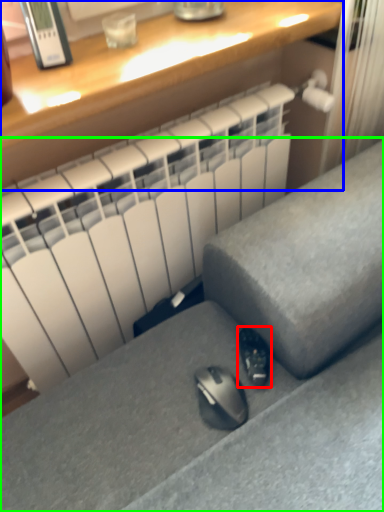
Question: Which is farther away from shoe (highlighted by a red box)? desk (highlighted by a blue box) or furniture (highlighted by a green box)?

Choices:
 (A) desk
 (B) furniture

Answer: (A)